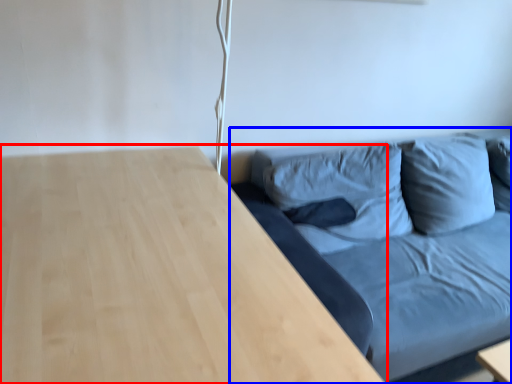
Question: Among these objects, which one is farthest to the camera, table (highlighted by a red box) or studio couch (highlighted by a blue box)?

Choices:
 (A) table
 (B) studio couch

Answer: (B)